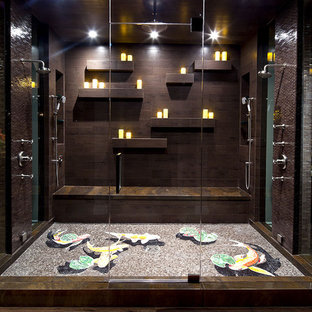
Find the location of `floor`. floor is located at coordinates (171, 261).